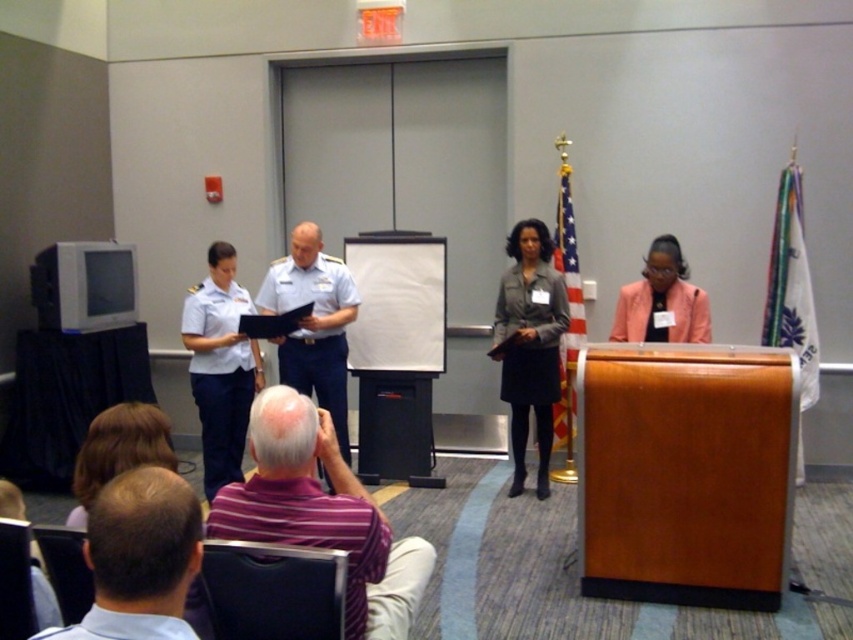
Question: Which object is the closest to the pink fabric jacket at right?

Choices:
 (A) matte gray skirt at center
 (B) white uniform at center
 (C) white fabric uniform at center

Answer: (A)

Question: Which is farther from the light brown hair at lower left?

Choices:
 (A) matte gray skirt at center
 (B) pink fabric jacket at right

Answer: (A)

Question: Does purple striped shirt at lower center come in front of white fabric uniform at center?

Choices:
 (A) yes
 (B) no

Answer: (A)

Question: Can you confirm if white fabric uniform at center is positioned below pink fabric jacket at right?

Choices:
 (A) yes
 (B) no

Answer: (A)

Question: Can you confirm if purple striped shirt at lower center is positioned below matte gray skirt at center?

Choices:
 (A) yes
 (B) no

Answer: (A)

Question: Which of the following is the farthest from the observer?

Choices:
 (A) light brown hair at lower left
 (B) white fabric uniform at center
 (C) white uniform at center
 (D) blonde hair at lower left

Answer: (C)